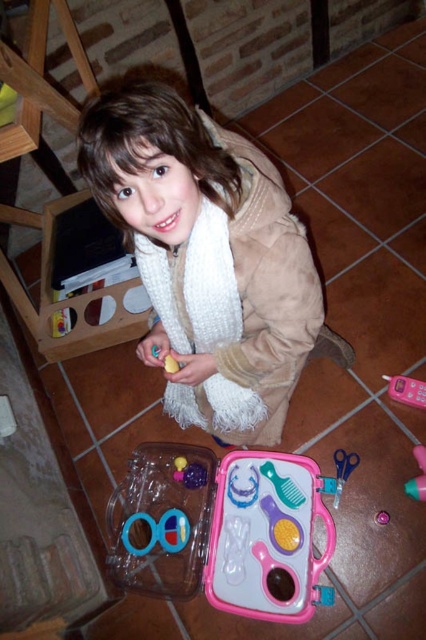
You are a parent trying to retrieve the pink plastic toy phone at lower right for your child. Is the white fuzzy scarf at center blocking your access to it?

Result: The white fuzzy scarf at center is positioned over the pink plastic toy phone at lower right, so it is blocking access to the phone.

You are a parent trying to organize the toys. You see two points marked in the image. The first point is at coordinate point(210, 387) and the second is at point(187, 461). Which point is closer to the child?

Point(210, 387) is in front of point(187, 461), so it is closer to the child.